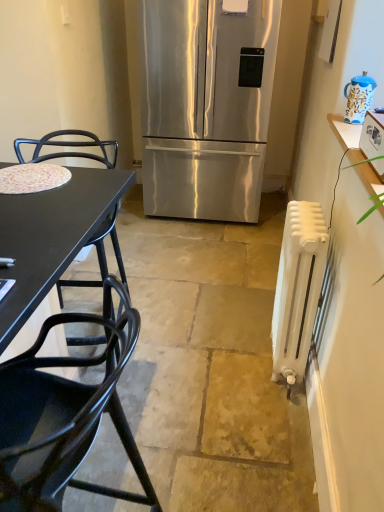
Locate an element on the screen. The image size is (384, 512). vacant space in white plastic toaster at upper right (from a real-world perspective) is located at coordinates (371, 161).